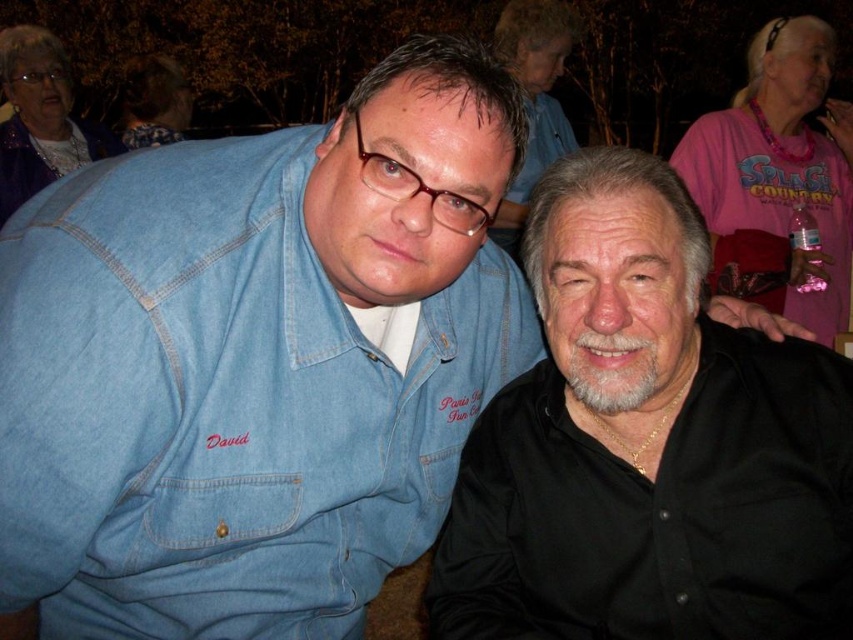
You are a photographer at a social event and need to adjust your camera to focus on the pink fabric shirt at upper right and the denim shirt at center. Which of these two shirts is closer to the camera?

The pink fabric shirt at upper right is positioned over denim shirt at center, meaning it is closer to the camera.

You are standing in the scene and want to move from the point at coordinates point (715, 196) to the point at coordinates point (366, 339). Which direction should you move to get closer to the latter?

To move from point (715, 196) to point (366, 339), you should move downward and to the right since point (366, 339) is closer to the viewer and positioned lower and to the right compared to point (715, 196).

You are a photographer at this event and want to ensure both the black matte shirt at center and the matte black hair at upper left are clearly visible in your photo. Given their positions, which object should you focus on first to ensure proper depth of field?

The black matte shirt at center should be focused on first because it has a greater height compared to the matte black hair at upper left, so it is closer to the camera. Adjusting focus starting from the closer object ensures both are in focus when using proper depth of field techniques.